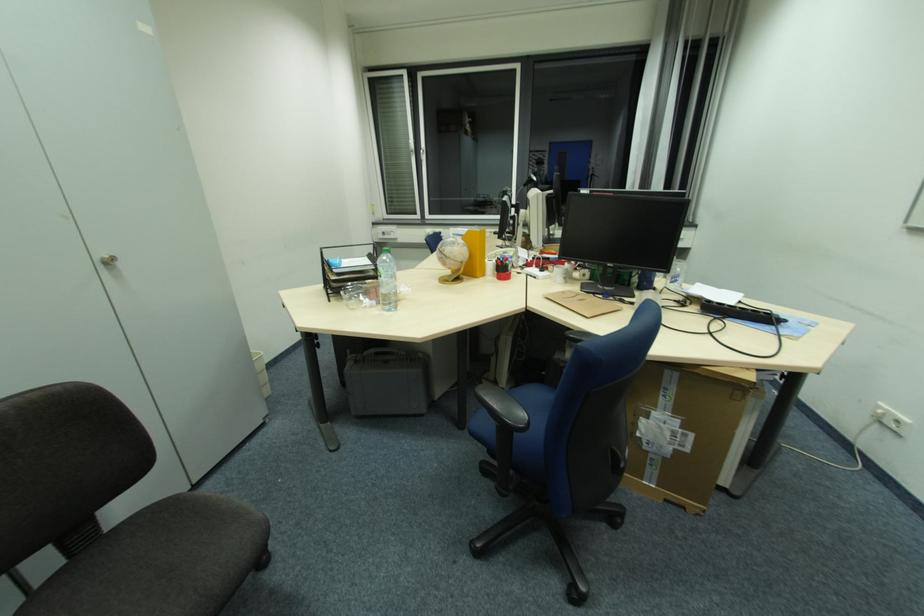
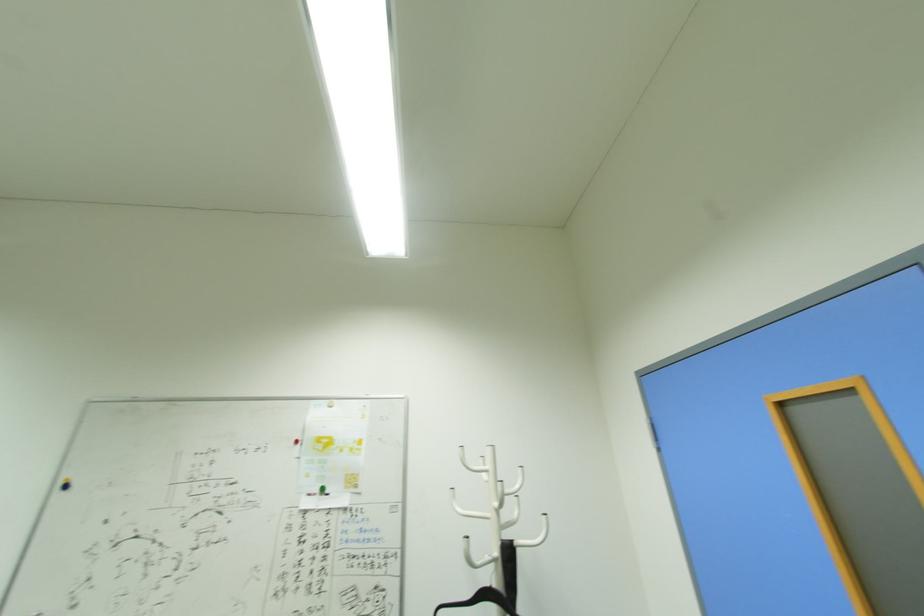
The first image is from the beginning of the video and the second image is from the end. How did the camera likely rotate when shooting the video?

The rotation direction of the camera is right-up.